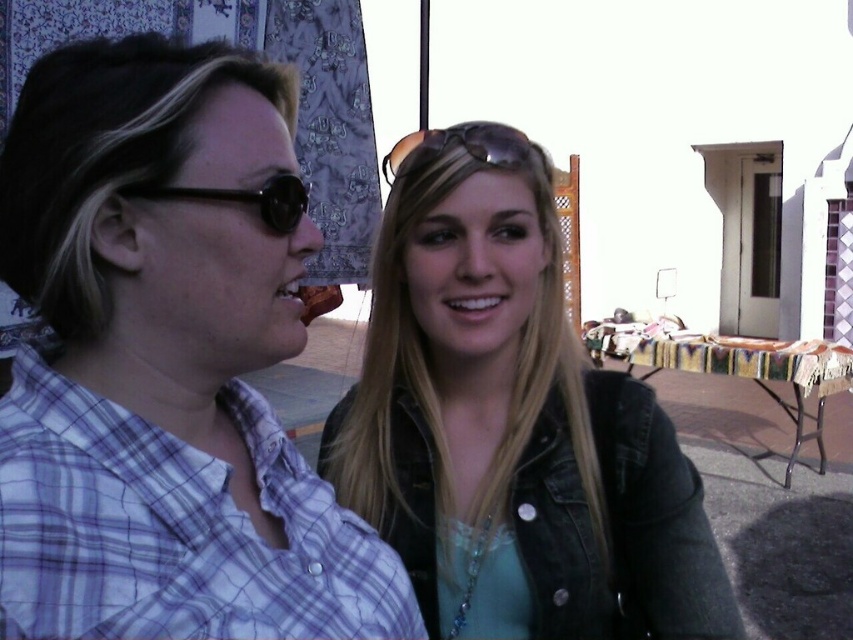
In the scene shown: Is denim jacket at center closer to camera compared to sunglasses at left?

No, denim jacket at center is behind sunglasses at left.

Who is more forward, (370, 508) or (229, 195)?

Point (229, 195) is in front.

This screenshot has height=640, width=853. Find the location of `denim jacket at center`. denim jacket at center is located at coordinates (512, 422).

Is plaid shirt at left behind denim jacket at center?

No.

Who is shorter, plaid shirt at left or denim jacket at center?

With less height is plaid shirt at left.

This screenshot has height=640, width=853. In order to click on plaid shirt at left in this screenshot , I will do `click(164, 364)`.

Is point (444, 148) farther from viewer compared to point (277, 196)?

That is True.

Who is higher up, sunglasses at center or sunglasses at left?

sunglasses at center

Which is behind, point (482, 138) or point (209, 196)?

Positioned behind is point (482, 138).

Where is `sunglasses at center`? The width and height of the screenshot is (853, 640). sunglasses at center is located at coordinates (459, 145).